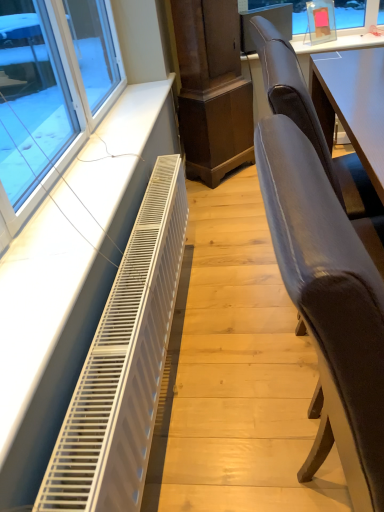
Question: Considering the relative positions of white metallic radiator at lower left and velvet grey chair at right, positioned as the first chair in front-to-back order, in the image provided, is white metallic radiator at lower left to the left or to the right of velvet grey chair at right, positioned as the first chair in front-to-back order,?

Choices:
 (A) left
 (B) right

Answer: (A)

Question: Is white metallic radiator at lower left bigger or smaller than velvet grey chair at right, positioned as the first chair in front-to-back order?

Choices:
 (A) small
 (B) big

Answer: (A)

Question: Based on their relative distances, which object is nearer to the suede-like brown chair at right, positioned as the second chair in front-to-back order?

Choices:
 (A) velvet grey chair at right, placed as the second chair when sorted from back to front
 (B) white metallic radiator at lower left

Answer: (A)

Question: Which object is the closest to the white metallic radiator at lower left?

Choices:
 (A) suede-like brown chair at right, positioned as the second chair in front-to-back order
 (B) velvet grey chair at right, placed as the second chair when sorted from back to front

Answer: (B)